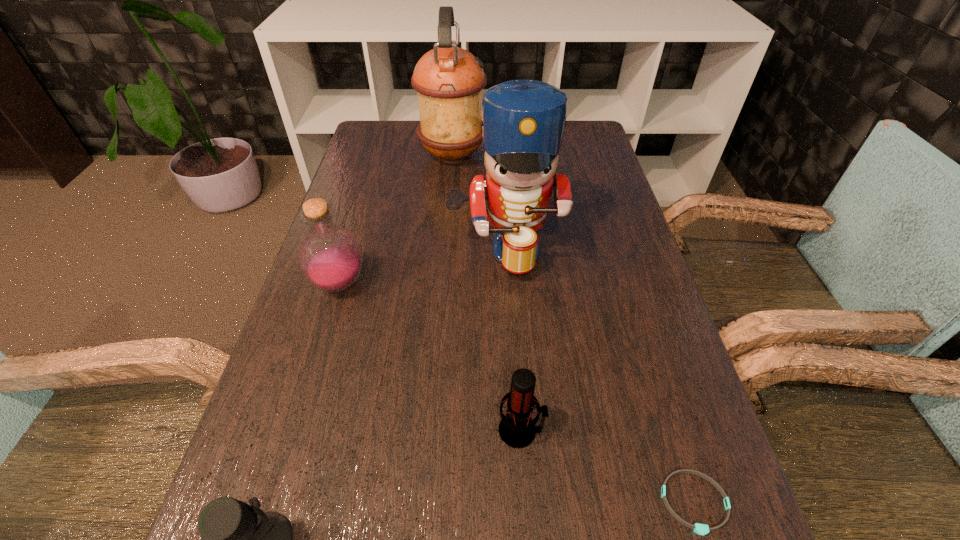
At what (x,y) coordinates should I click in order to perform the action: click on vacant point located between the oil lamp and the rightmost object. Please return your answer as a coordinate pair (x, y). This screenshot has width=960, height=540. Looking at the image, I should click on (573, 329).

Where is `free space between the third nearest object and the nutcracker`? The image size is (960, 540). free space between the third nearest object and the nutcracker is located at coordinates (513, 340).

The width and height of the screenshot is (960, 540). I want to click on free space that is in between the right microphone and the third tallest object, so click(430, 357).

Select which object appears as the fourth closest to the left microphone. Please provide its 2D coordinates. Your answer should be formatted as a tuple, i.e. [(x, y)], where the tuple contains the x and y coordinates of a point satisfying the conditions above.

[(702, 529)]

The width and height of the screenshot is (960, 540). Find the location of `object that ranks as the fourth closest to the shortest object`. object that ranks as the fourth closest to the shortest object is located at coordinates (330, 257).